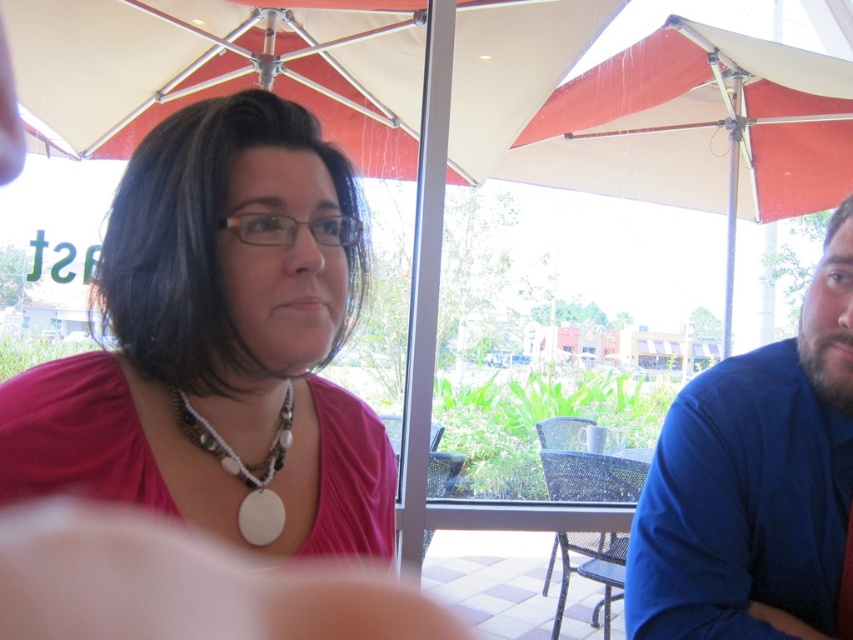
Question: Can you confirm if white fabric umbrella at upper center is wider than blue fabric shirt at right?

Choices:
 (A) no
 (B) yes

Answer: (B)

Question: Which of the following is the farthest from the observer?

Choices:
 (A) (316, 44)
 (B) (131, 291)
 (C) (262, 531)

Answer: (A)

Question: Which point is farther from the camera taking this photo?

Choices:
 (A) (192, 440)
 (B) (747, 440)

Answer: (B)

Question: Does pink fabric shirt at center lie behind white fabric umbrella at upper center?

Choices:
 (A) no
 (B) yes

Answer: (A)

Question: Can you confirm if blue fabric shirt at right is positioned to the left of white matte pendant at center?

Choices:
 (A) no
 (B) yes

Answer: (A)

Question: Which of the following is the closest to the observer?

Choices:
 (A) blue fabric shirt at right
 (B) pink fabric shirt at center
 (C) white fabric umbrella at upper center

Answer: (B)